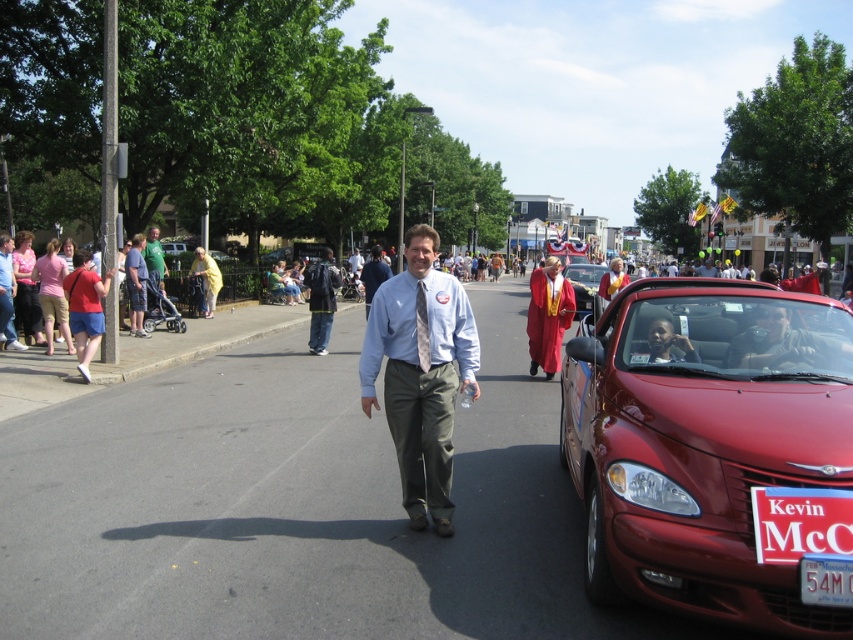
You are standing in the middle of the street during the parade. There are two points of interest marked on the ground in front of you. The first point is at coordinates point (635, 483) and the second is at point (442, 428). Which point is closer to you?

Point (635, 483) is closer to the camera than point (442, 428).

You are a photographer at the event and want to capture both the light blue shirt at center and the matte gold graduation gown at center in a single frame. Which object should you focus on first to ensure both are in the frame?

The light blue shirt at center is smaller than the matte gold graduation gown at center, so you should focus on the matte gold graduation gown at center first to ensure both are in the frame.